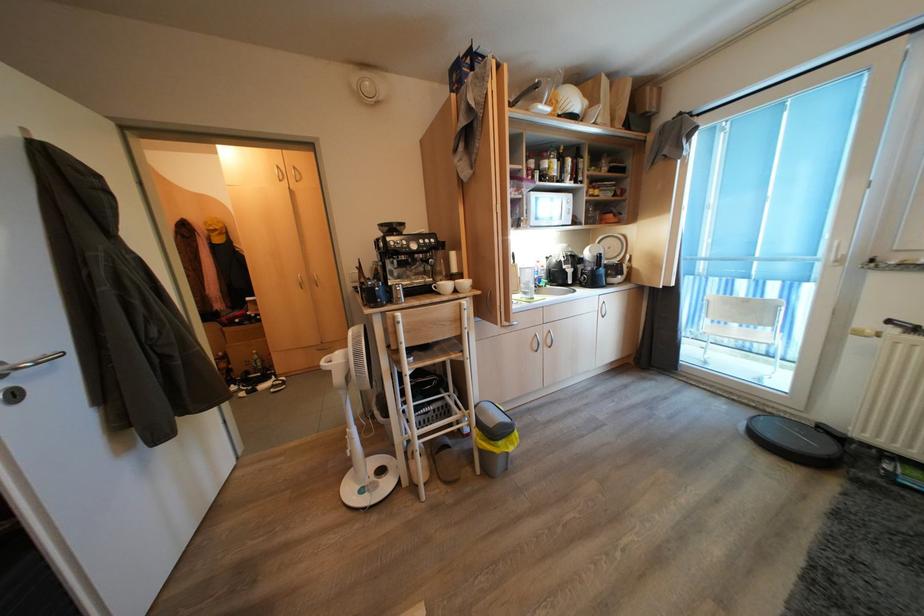
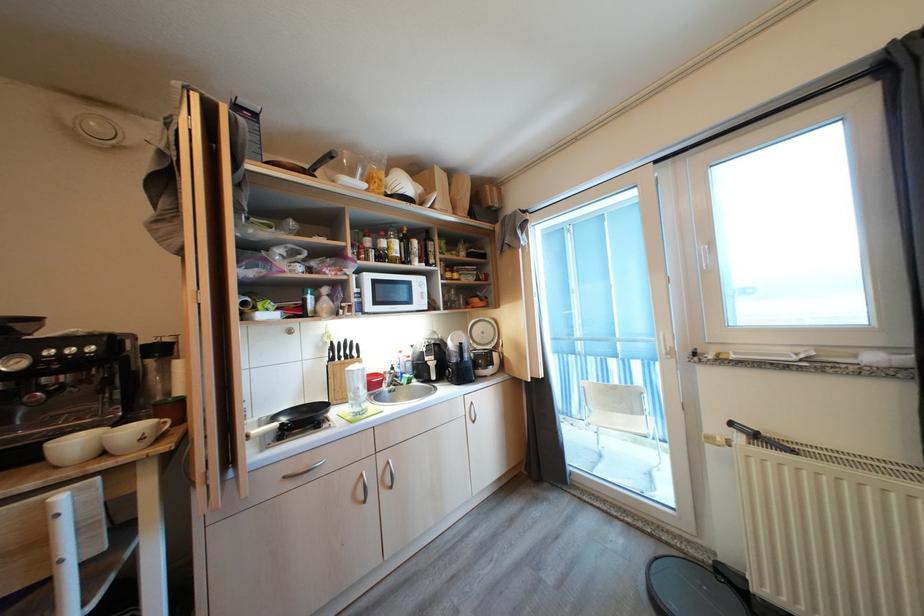
Where in the second image is the point corresponding to the point at 552,331 from the first image?

(387, 462)